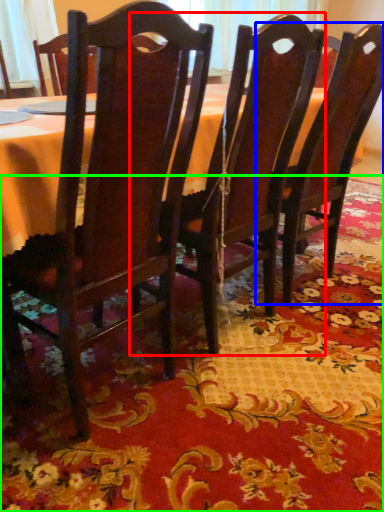
Question: Which is farther away from chair (highlighted by a red box)? chair (highlighted by a blue box) or place mat (highlighted by a green box)?

Choices:
 (A) chair
 (B) place mat

Answer: (B)